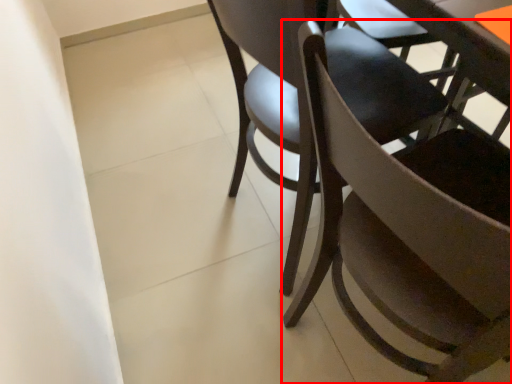
Question: In this image, where is chair (annotated by the red box) located relative to chair?

Choices:
 (A) right
 (B) left

Answer: (A)